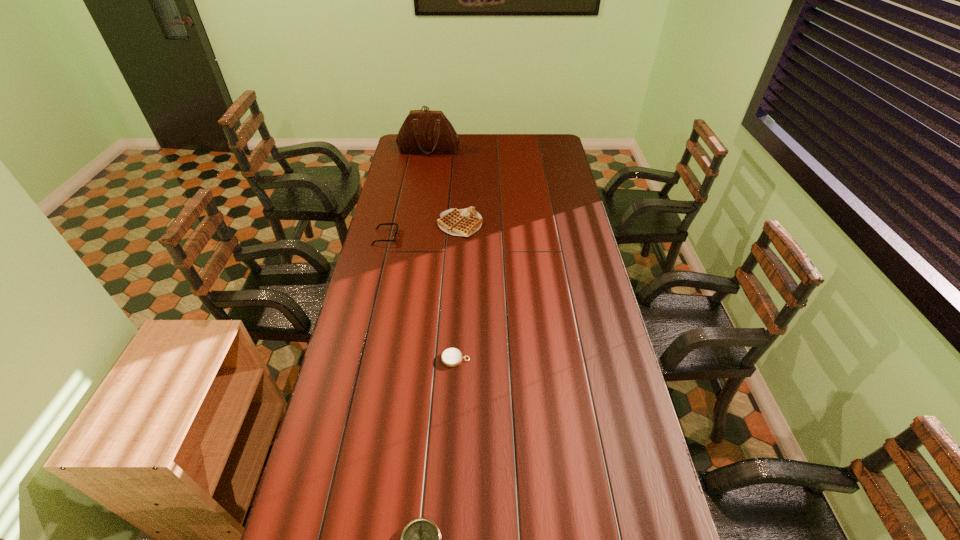
You are a GUI agent. You are given a task and a screenshot of the screen. Output one action in this format:
    pyautogui.click(x=<x>, y=<y>)
    Task: Click on the object that is at the far edge
    The height and width of the screenshot is (540, 960).
    Given the screenshot: What is the action you would take?
    pyautogui.click(x=423, y=131)

This screenshot has width=960, height=540. Identify the location of shoulder bag at the left edge. (423, 131).

Locate an element on the screen. This screenshot has width=960, height=540. sunglasses that is positioned at the left edge is located at coordinates (396, 224).

You are a GUI agent. You are given a task and a screenshot of the screen. Output one action in this format:
    pyautogui.click(x=<x>, y=<y>)
    Task: Click on the object positioned at the far left corner
    This screenshot has height=540, width=960.
    Given the screenshot: What is the action you would take?
    pyautogui.click(x=423, y=131)

The width and height of the screenshot is (960, 540). In the image, there is a desktop. Find the location of `vacant space at the far edge`. vacant space at the far edge is located at coordinates (477, 136).

Where is `vacant space at the left edge`? The width and height of the screenshot is (960, 540). vacant space at the left edge is located at coordinates (365, 334).

Identify the location of free space at the right edge of the desktop. (560, 227).

Where is `free spot between the shortest object and the shoulder bag`? Image resolution: width=960 pixels, height=540 pixels. free spot between the shortest object and the shoulder bag is located at coordinates (443, 254).

The height and width of the screenshot is (540, 960). In order to click on vacant region between the shortest object and the shoulder bag in this screenshot , I will do [x=443, y=254].

Where is `empty location between the farthest object and the farther compass`? The image size is (960, 540). empty location between the farthest object and the farther compass is located at coordinates (443, 254).